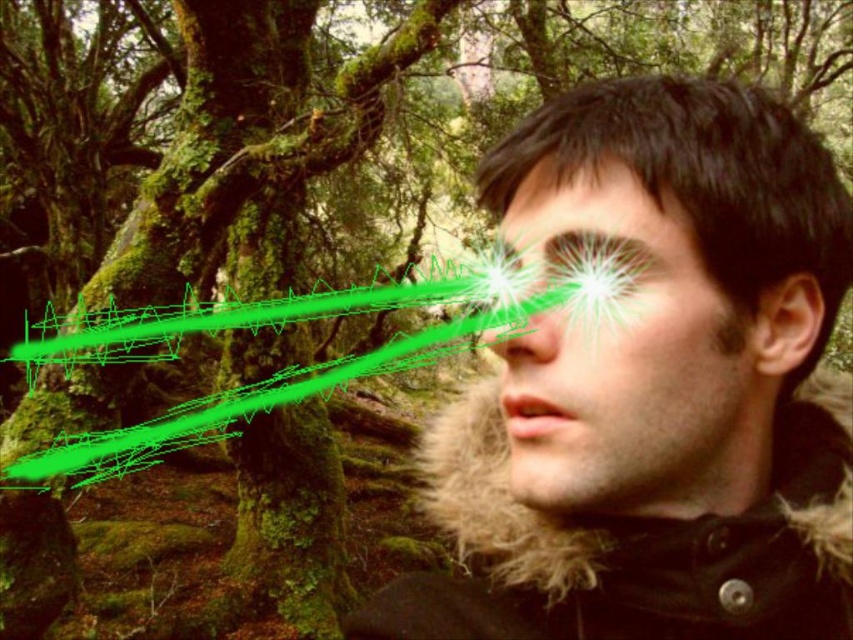
Can you confirm if dark brown fur coat at center is shorter than matte black face at center?

No, dark brown fur coat at center is not shorter than matte black face at center.

This screenshot has width=853, height=640. What do you see at coordinates (654, 390) in the screenshot? I see `dark brown fur coat at center` at bounding box center [654, 390].

The height and width of the screenshot is (640, 853). Identify the location of dark brown fur coat at center. (654, 390).